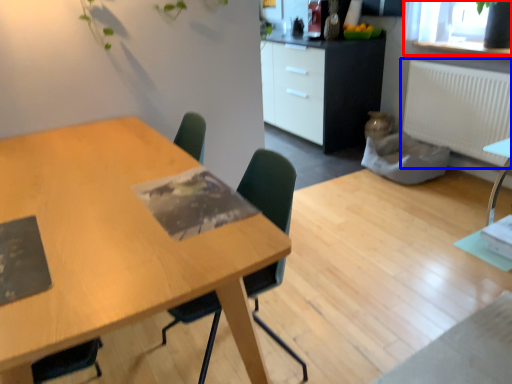
Question: Which of the following is the farthest to the observer, window screen (highlighted by a red box) or radiator (highlighted by a blue box)?

Choices:
 (A) window screen
 (B) radiator

Answer: (B)